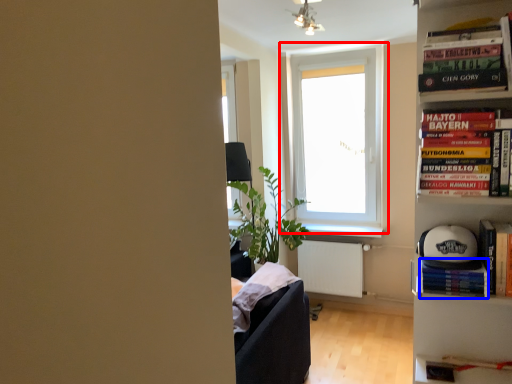
Question: Which object appears farthest to the camera in this image, window (highlighted by a red box) or paperback book (highlighted by a blue box)?

Choices:
 (A) window
 (B) paperback book

Answer: (A)